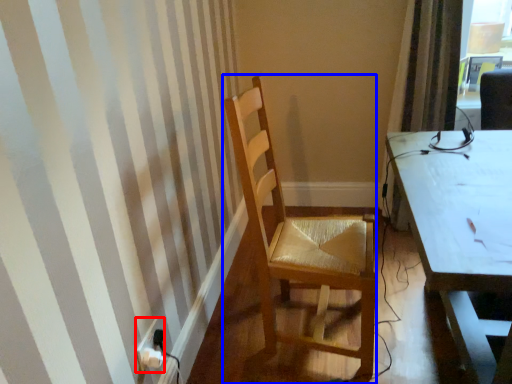
Question: Which of the following is the closest to the observer, power plugs and sockets (highlighted by a red box) or chair (highlighted by a blue box)?

Choices:
 (A) power plugs and sockets
 (B) chair

Answer: (B)